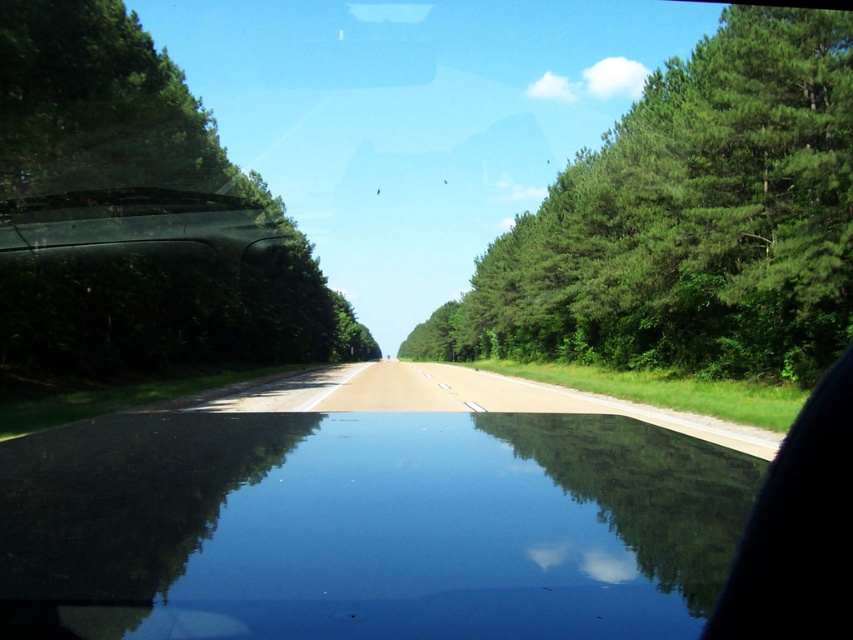
Is green leafy trees at right thinner than green leafy tree at left?

No.

Is green leafy trees at right positioned at the back of green leafy tree at left?

Yes, it is.

Is point (764, 289) positioned before point (38, 93)?

No, (764, 289) is further to viewer.

Identify the location of green leafy trees at right. (689, 221).